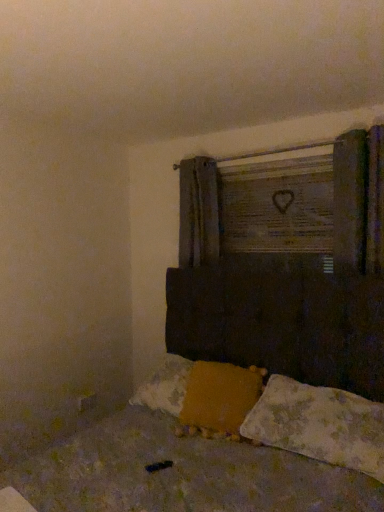
Question: Could you tell me if wooden sign at upper center is facing fluffy white pillow at lower right, the 2th pillow viewed from the left?

Choices:
 (A) yes
 (B) no

Answer: (B)

Question: Is wooden sign at upper center not within fluffy white pillow at lower right, the 2th pillow viewed from the left?

Choices:
 (A) yes
 (B) no

Answer: (A)

Question: From a real-world perspective, does wooden sign at upper center sit lower than fluffy white pillow at lower right, the 1th pillow from the right?

Choices:
 (A) no
 (B) yes

Answer: (A)

Question: Can you confirm if wooden sign at upper center is positioned to the left of fluffy white pillow at lower right, the 2th pillow viewed from the left?

Choices:
 (A) no
 (B) yes

Answer: (B)

Question: Can you confirm if wooden sign at upper center is bigger than fluffy white pillow at lower right, the 2th pillow viewed from the left?

Choices:
 (A) yes
 (B) no

Answer: (B)

Question: Is wooden sign at upper center bigger or smaller than yellow fabric pillow at lower center, marked as the second pillow in a right-to-left arrangement?

Choices:
 (A) small
 (B) big

Answer: (A)

Question: Is wooden sign at upper center wider or thinner than yellow fabric pillow at lower center, marked as the second pillow in a right-to-left arrangement?

Choices:
 (A) thin
 (B) wide

Answer: (A)

Question: Would you say wooden sign at upper center is inside or outside yellow fabric pillow at lower center, marked as the second pillow in a right-to-left arrangement?

Choices:
 (A) inside
 (B) outside

Answer: (B)

Question: From a real-world perspective, relative to yellow fabric pillow at lower center, which is counted as the 1th pillow, starting from the left, is wooden sign at upper center vertically above or below?

Choices:
 (A) below
 (B) above

Answer: (B)

Question: Based on their positions, is yellow fabric pillow at lower center, which is counted as the 1th pillow, starting from the left, located to the left or right of fluffy white pillow at lower right, the 2th pillow viewed from the left?

Choices:
 (A) left
 (B) right

Answer: (A)

Question: From a real-world perspective, is yellow fabric pillow at lower center, marked as the second pillow in a right-to-left arrangement, physically located above or below fluffy white pillow at lower right, the 1th pillow from the right?

Choices:
 (A) above
 (B) below

Answer: (A)

Question: From the image's perspective, is yellow fabric pillow at lower center, marked as the second pillow in a right-to-left arrangement, above or below fluffy white pillow at lower right, the 1th pillow from the right?

Choices:
 (A) below
 (B) above

Answer: (B)

Question: Considering the positions of yellow fabric pillow at lower center, which is counted as the 1th pillow, starting from the left, and fluffy white pillow at lower right, the 1th pillow from the right, in the image, is yellow fabric pillow at lower center, which is counted as the 1th pillow, starting from the left, bigger or smaller than fluffy white pillow at lower right, the 1th pillow from the right,?

Choices:
 (A) small
 (B) big

Answer: (A)

Question: Considering the positions of fluffy white pillow at lower right, the 2th pillow viewed from the left, and wooden sign at upper center in the image, is fluffy white pillow at lower right, the 2th pillow viewed from the left, bigger or smaller than wooden sign at upper center?

Choices:
 (A) big
 (B) small

Answer: (A)

Question: From the image's perspective, relative to wooden sign at upper center, is fluffy white pillow at lower right, the 2th pillow viewed from the left, above or below?

Choices:
 (A) above
 (B) below

Answer: (B)